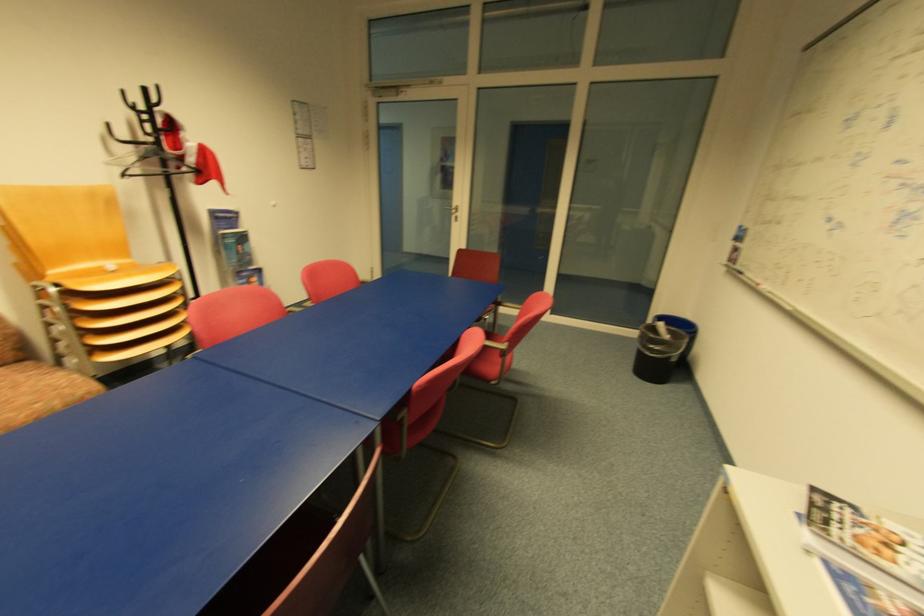
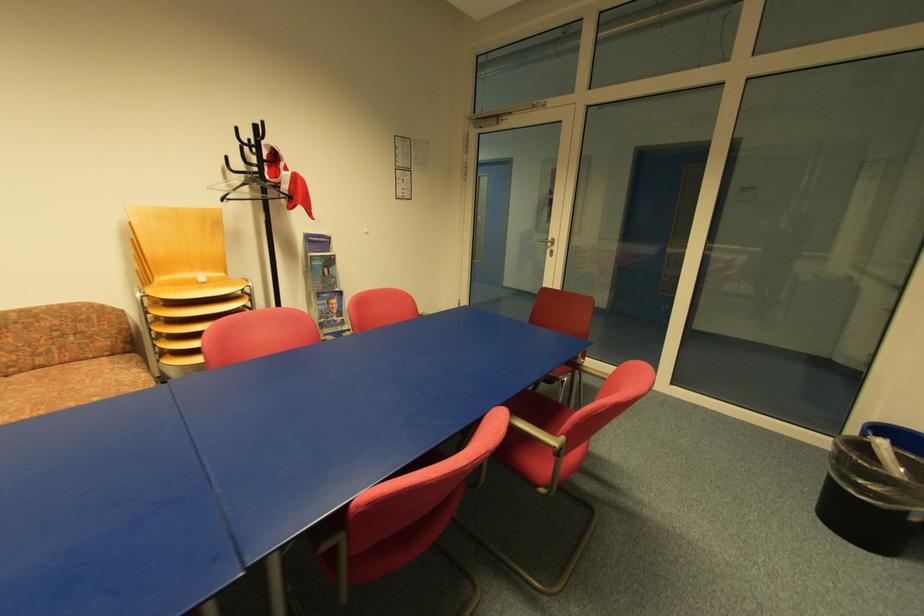
Locate, in the second image, the point that corresponds to the point at 509,344 in the first image.

(565, 439)